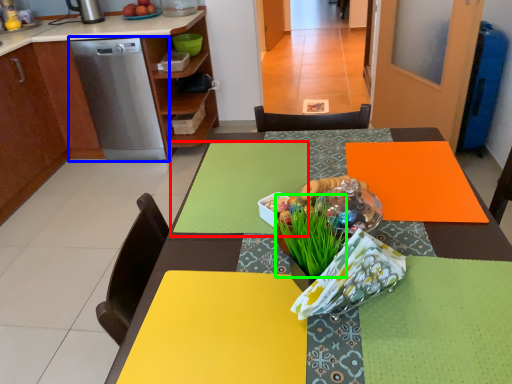
Question: Which object is positioned farthest from tablecloth (highlighted by a red box)? Select from home appliance (highlighted by a blue box) and grass (highlighted by a green box).

Choices:
 (A) home appliance
 (B) grass

Answer: (A)